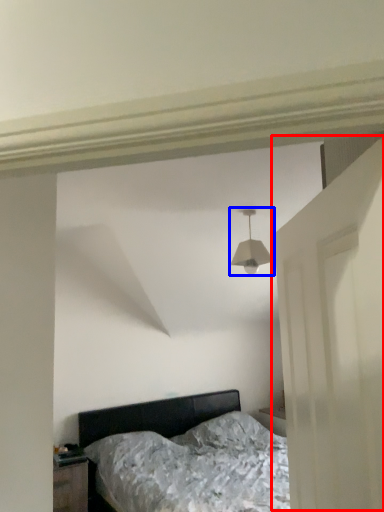
Question: Which object is closer to the camera taking this photo, door (highlighted by a red box) or lamp (highlighted by a blue box)?

Choices:
 (A) door
 (B) lamp

Answer: (A)